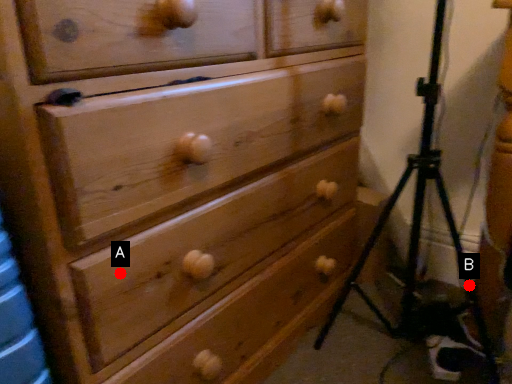
Question: Two points are circled on the image, labeled by A and B beside each circle. Which point is closer to the camera?

Choices:
 (A) A is closer
 (B) B is closer

Answer: (A)